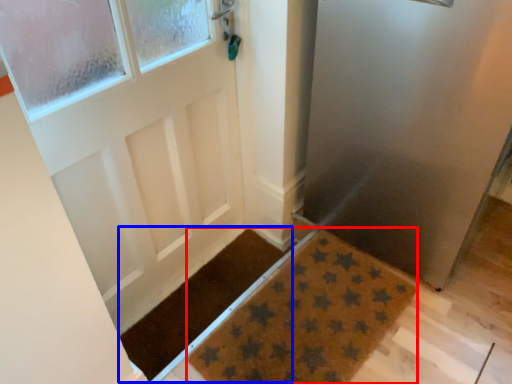
Question: Among these objects, which one is nearest to the camera, doormat (highlighted by a red box) or doormat (highlighted by a blue box)?

Choices:
 (A) doormat
 (B) doormat

Answer: (A)